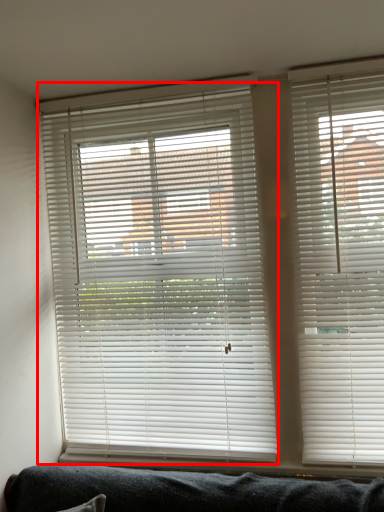
Question: From the image, what is the correct spatial relationship of window blind (annotated by the red box) in relation to window blind?

Choices:
 (A) right
 (B) left

Answer: (B)